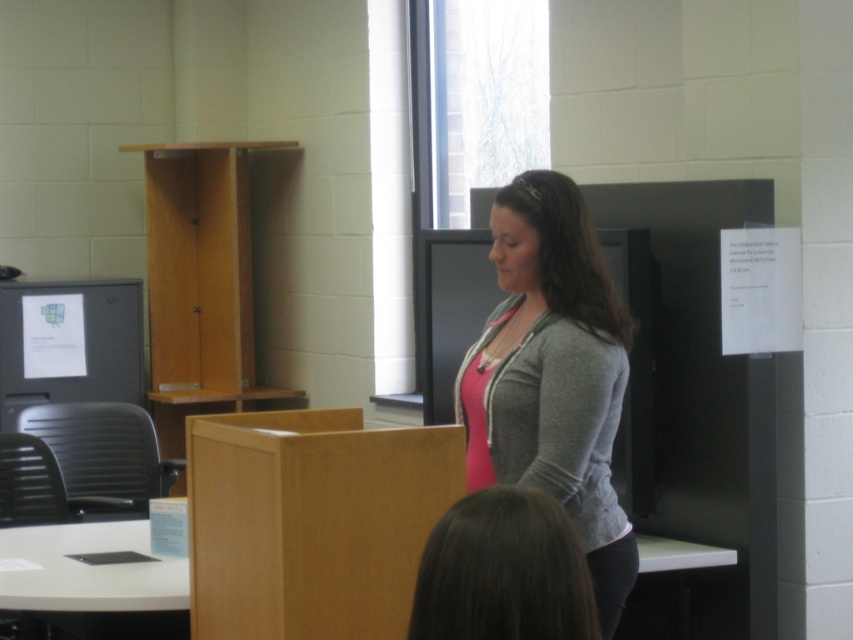
In the scene shown: You are organizing a presentation and need to place a laptop on the desk. The laptop is 3 cm thick. Which object, the gray fleece jacket at center or the matte black monitor at left, is more suitable to place the laptop on based on their thickness?

The gray fleece jacket at center is thinner than the matte black monitor at left, so placing the laptop on the matte black monitor at left would provide a more stable surface since it is thicker and can better support the laptop.

You are a photographer in the room and want to capture a photo where both the brown smooth hair at lower center and the matte black monitor at left are visible. Which object should you adjust your camera angle to focus on first to ensure both are in frame?

The brown smooth hair at lower center has a lesser height compared to the matte black monitor at left, so you should focus on the matte black monitor at left first to ensure both are in frame.

You are standing in the classroom and want to move from the point at coordinates point (549, 456) to the point at coordinates point (462, 614). Which direction should you move?

Since point (549, 456) is behind point (462, 614), you should move forward to reach the point at coordinates point (462, 614).